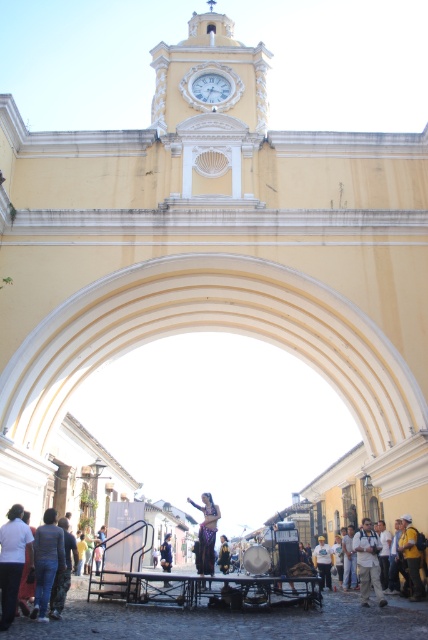
Does point (5, 611) come in front of point (166, 563)?

Yes, it is.

Locate an element on the screen. jeans at lower left is located at coordinates (30, 560).

Is light brown leather jacket at center taller than shiny gold dress at center?

Indeed, light brown leather jacket at center has a greater height compared to shiny gold dress at center.

Who is lower down, light brown leather jacket at center or shiny gold dress at center?

shiny gold dress at center is lower down.

Where is `light brown leather jacket at center`? The width and height of the screenshot is (428, 640). light brown leather jacket at center is located at coordinates (368, 563).

Locate an element on the screen. The image size is (428, 640). light brown leather jacket at center is located at coordinates (368, 563).

Looking at this image, is yellow fabric at lower right to the left of shiny gold dress at center from the viewer's perspective?

No, yellow fabric at lower right is not to the left of shiny gold dress at center.

The width and height of the screenshot is (428, 640). Describe the element at coordinates (410, 556) in the screenshot. I see `yellow fabric at lower right` at that location.

The width and height of the screenshot is (428, 640). In order to click on yellow fabric at lower right in this screenshot , I will do `click(410, 556)`.